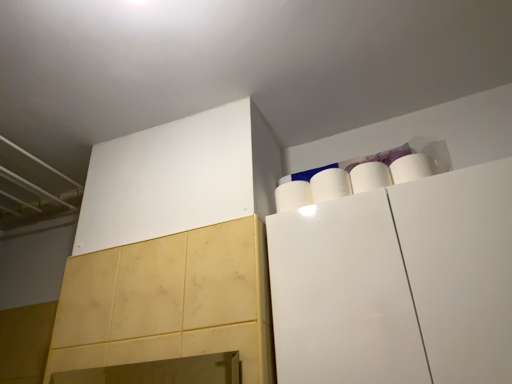
Question: Would you say white matte paper towel at upper right, placed as the 3th paper towel when sorted from right to left, contains white matte paper towel at upper right, which ranks as the 1th paper towel in right-to-left order?

Choices:
 (A) yes
 (B) no

Answer: (B)

Question: Is white matte paper towel at upper right, arranged as the first paper towel when viewed from the left, directly adjacent to white matte paper towel at upper right, the third paper towel in the left-to-right sequence?

Choices:
 (A) no
 (B) yes

Answer: (A)

Question: From the image's perspective, is white matte paper towel at upper right, arranged as the first paper towel when viewed from the left, on top of white matte paper towel at upper right, the third paper towel in the left-to-right sequence?

Choices:
 (A) yes
 (B) no

Answer: (B)

Question: Does white matte paper towel at upper right, arranged as the first paper towel when viewed from the left, have a lesser height compared to white matte paper towel at upper right, which ranks as the 1th paper towel in right-to-left order?

Choices:
 (A) no
 (B) yes

Answer: (B)

Question: Is white matte paper towel at upper right, placed as the 3th paper towel when sorted from right to left, facing away from white matte paper towel at upper right, which ranks as the 1th paper towel in right-to-left order?

Choices:
 (A) yes
 (B) no

Answer: (B)

Question: Is white matte paper towel at upper right, arranged as the first paper towel when viewed from the left, taller or shorter than white matte cabinet at upper right?

Choices:
 (A) short
 (B) tall

Answer: (A)

Question: Considering their positions, is white matte paper towel at upper right, arranged as the first paper towel when viewed from the left, located in front of or behind white matte cabinet at upper right?

Choices:
 (A) behind
 (B) front

Answer: (A)

Question: Based on their sizes in the image, would you say white matte paper towel at upper right, arranged as the first paper towel when viewed from the left, is bigger or smaller than white matte cabinet at upper right?

Choices:
 (A) big
 (B) small

Answer: (B)

Question: Visually, is white matte paper towel at upper right, placed as the 3th paper towel when sorted from right to left, positioned to the left or to the right of white matte cabinet at upper right?

Choices:
 (A) right
 (B) left

Answer: (B)

Question: Is point (301, 200) positioned closer to the camera than point (352, 178)?

Choices:
 (A) closer
 (B) farther

Answer: (B)

Question: Considering the relative positions of white matte paper towel at upper right, placed as the 3th paper towel when sorted from right to left, and white matte paper towel at upper right, the third paper towel in the left-to-right sequence, in the image provided, is white matte paper towel at upper right, placed as the 3th paper towel when sorted from right to left, to the left or to the right of white matte paper towel at upper right, the third paper towel in the left-to-right sequence,?

Choices:
 (A) left
 (B) right

Answer: (A)

Question: From the image's perspective, relative to white matte paper towel at upper right, which ranks as the 1th paper towel in right-to-left order, is white matte paper towel at upper right, arranged as the first paper towel when viewed from the left, above or below?

Choices:
 (A) above
 (B) below

Answer: (B)

Question: Looking at their shapes, would you say white matte paper towel at upper right, placed as the 3th paper towel when sorted from right to left, is wider or thinner than white matte paper towel at upper right, the third paper towel in the left-to-right sequence?

Choices:
 (A) wide
 (B) thin

Answer: (A)

Question: In terms of width, does white matte paper towel at upper right, arranged as the 2th paper towel when viewed from the right, look wider or thinner when compared to white matte cabinet at upper right?

Choices:
 (A) wide
 (B) thin

Answer: (B)

Question: From the image's perspective, is white matte paper towel at upper right, arranged as the 2th paper towel when viewed from the right, positioned above or below white matte cabinet at upper right?

Choices:
 (A) below
 (B) above

Answer: (B)